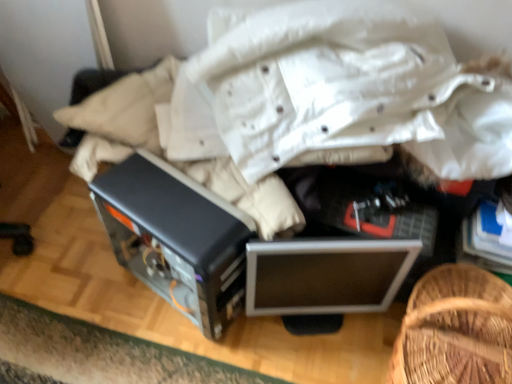
Question: Considering the positions of point (356, 246) and point (130, 223), is point (356, 246) closer or farther from the camera than point (130, 223)?

Choices:
 (A) farther
 (B) closer

Answer: (B)

Question: Is silver metallic monitor at center taller or shorter than satin black computer case at center?

Choices:
 (A) tall
 (B) short

Answer: (B)

Question: Considering the real-world distances, which object is farthest from the woven wood basket at lower right?

Choices:
 (A) satin black computer case at center
 (B) silver metallic monitor at center

Answer: (A)

Question: Based on their relative distances, which object is farther from the woven wood basket at lower right?

Choices:
 (A) silver metallic monitor at center
 (B) satin black computer case at center

Answer: (B)